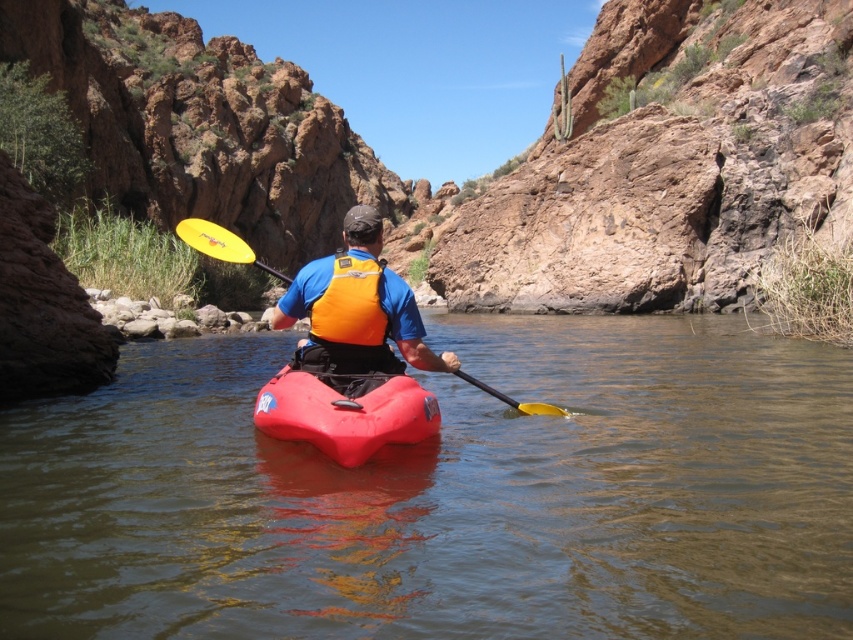
You are a safety inspector checking the equipment of a kayaker in a canyon. You notice the matte orange life vest at center and the yellow plastic paddle at center. Which piece of equipment is larger?

The yellow plastic paddle at center is larger than the matte orange life vest at center.